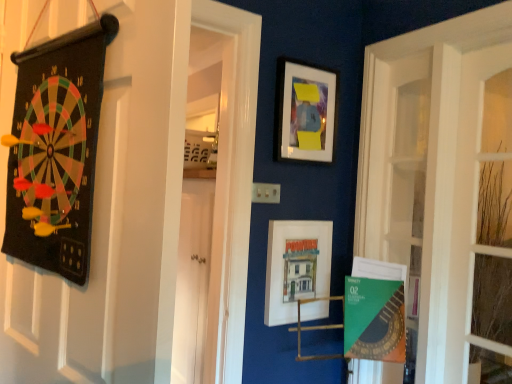
Question: Considering the relative sizes of green paper at lower right and black felt dartboard at left in the image provided, is green paper at lower right bigger than black felt dartboard at left?

Choices:
 (A) yes
 (B) no

Answer: (B)

Question: Is green paper at lower right positioned beyond the bounds of black felt dartboard at left?

Choices:
 (A) yes
 (B) no

Answer: (A)

Question: From the image's perspective, is green paper at lower right located beneath black felt dartboard at left?

Choices:
 (A) no
 (B) yes

Answer: (B)

Question: Is green paper at lower right shorter than black felt dartboard at left?

Choices:
 (A) yes
 (B) no

Answer: (A)

Question: Is green paper at lower right beside black felt dartboard at left?

Choices:
 (A) no
 (B) yes

Answer: (A)

Question: Based on their positions, is matte white picture frame at upper center, the 1th picture frame positioned from the top, located to the left or right of matte white picture frame at center, arranged as the 2th picture frame when viewed from the top?

Choices:
 (A) left
 (B) right

Answer: (B)

Question: Considering their positions, is matte white picture frame at upper center, the 1th picture frame positioned from the top, located in front of or behind matte white picture frame at center, arranged as the 2th picture frame when viewed from the top?

Choices:
 (A) front
 (B) behind

Answer: (B)

Question: Does point (321, 84) appear closer or farther from the camera than point (323, 309)?

Choices:
 (A) farther
 (B) closer

Answer: (B)

Question: From the image's perspective, is matte white picture frame at upper center, marked as the second picture frame in a bottom-to-top arrangement, located above or below matte white picture frame at center, arranged as the first picture frame when ordered from the bottom?

Choices:
 (A) below
 (B) above

Answer: (B)

Question: Is point (288, 109) positioned closer to the camera than point (249, 152)?

Choices:
 (A) closer
 (B) farther

Answer: (B)

Question: Considering the positions of matte white picture frame at upper center, marked as the second picture frame in a bottom-to-top arrangement, and black felt dartboard at left in the image, is matte white picture frame at upper center, marked as the second picture frame in a bottom-to-top arrangement, bigger or smaller than black felt dartboard at left?

Choices:
 (A) small
 (B) big

Answer: (A)

Question: Relative to black felt dartboard at left, is matte white picture frame at upper center, the 1th picture frame positioned from the top, in front or behind?

Choices:
 (A) front
 (B) behind

Answer: (B)

Question: From a real-world perspective, relative to black felt dartboard at left, is matte white picture frame at upper center, marked as the second picture frame in a bottom-to-top arrangement, vertically above or below?

Choices:
 (A) above
 (B) below

Answer: (A)

Question: In the image, is green paper at lower right positioned in front of or behind matte white picture frame at upper center, the 1th picture frame positioned from the top?

Choices:
 (A) front
 (B) behind

Answer: (A)

Question: Do you think green paper at lower right is within matte white picture frame at upper center, marked as the second picture frame in a bottom-to-top arrangement, or outside of it?

Choices:
 (A) outside
 (B) inside

Answer: (A)